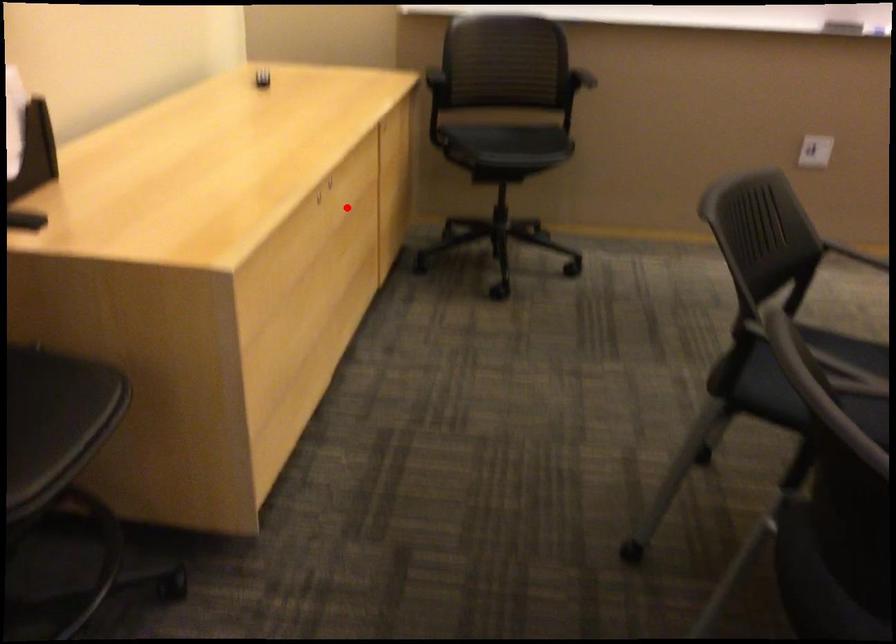
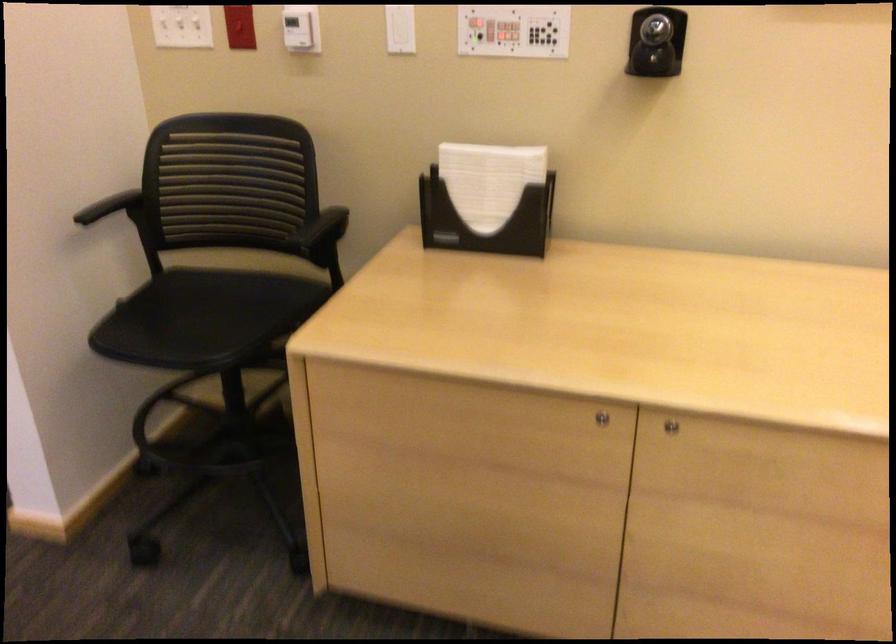
Locate, in the second image, the point that corresponds to the highlighted location in the first image.

(670, 426)